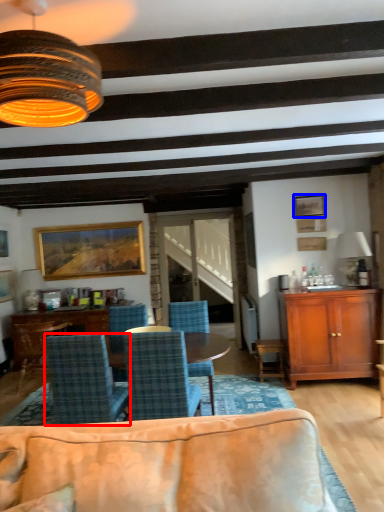
Question: Among these objects, which one is farthest to the camera, chair (highlighted by a red box) or picture frame (highlighted by a blue box)?

Choices:
 (A) chair
 (B) picture frame

Answer: (B)